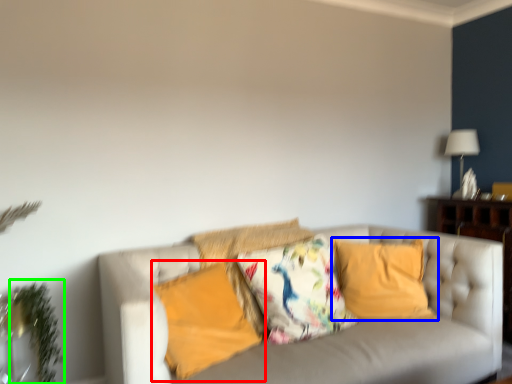
Question: Which object is the closest to the pillow (highlighted by a red box)? Choose among these: pillow (highlighted by a blue box) or plant (highlighted by a green box).

Choices:
 (A) pillow
 (B) plant

Answer: (B)